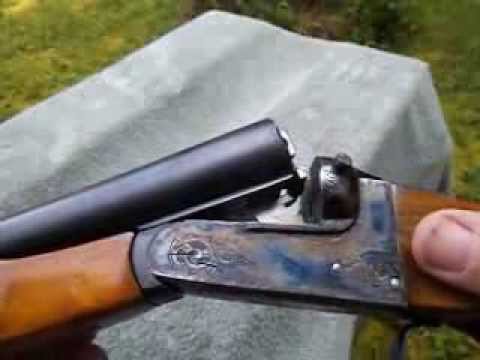
The image size is (480, 360). Identify the location of handle. (431, 294).